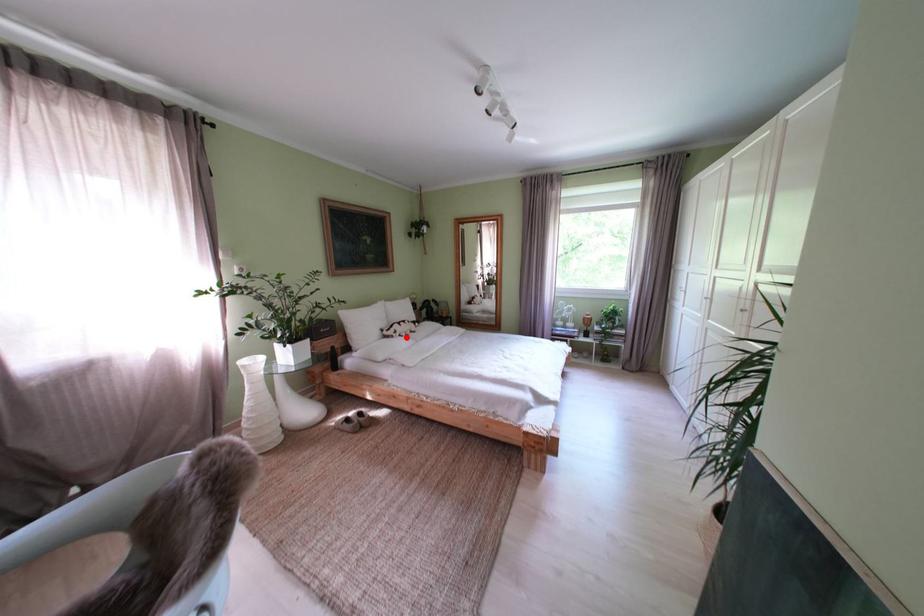
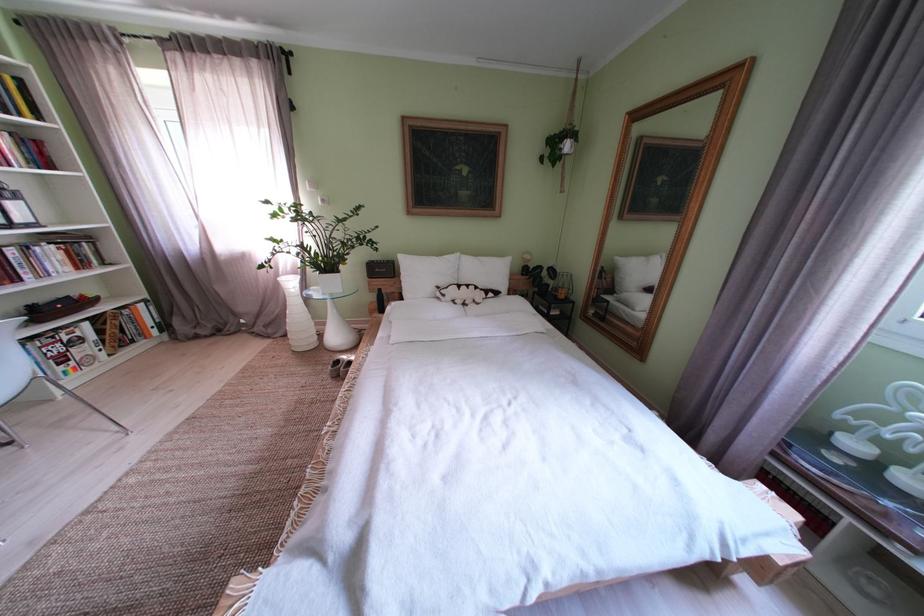
Locate, in the second image, the point that corresponds to the highlighted location in the first image.

(455, 301)